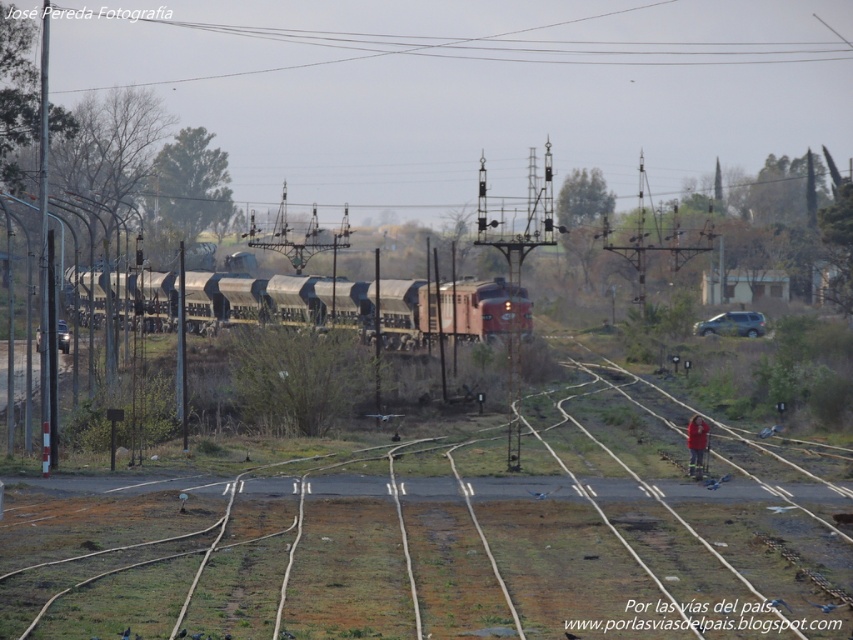
Which is more to the right, brown wooden track at center or red fabric jacket at lower right?

red fabric jacket at lower right

Is point (88, 481) positioned after point (708, 428)?

No, (88, 481) is in front of (708, 428).

Where is `brown wooden track at center`? brown wooden track at center is located at coordinates (436, 541).

Looking at this image, how far apart are brown wooden track at center and matte black train at center?

21.28 meters

Where is `brown wooden track at center`? Image resolution: width=853 pixels, height=640 pixels. brown wooden track at center is located at coordinates pyautogui.click(x=436, y=541).

Which is more to the right, matte black train at center or red fabric jacket at lower right?

red fabric jacket at lower right is more to the right.

Can you confirm if matte black train at center is thinner than red fabric jacket at lower right?

In fact, matte black train at center might be wider than red fabric jacket at lower right.

What do you see at coordinates (453, 308) in the screenshot?
I see `matte black train at center` at bounding box center [453, 308].

Find the location of a particular element. The image size is (853, 640). matte black train at center is located at coordinates (453, 308).